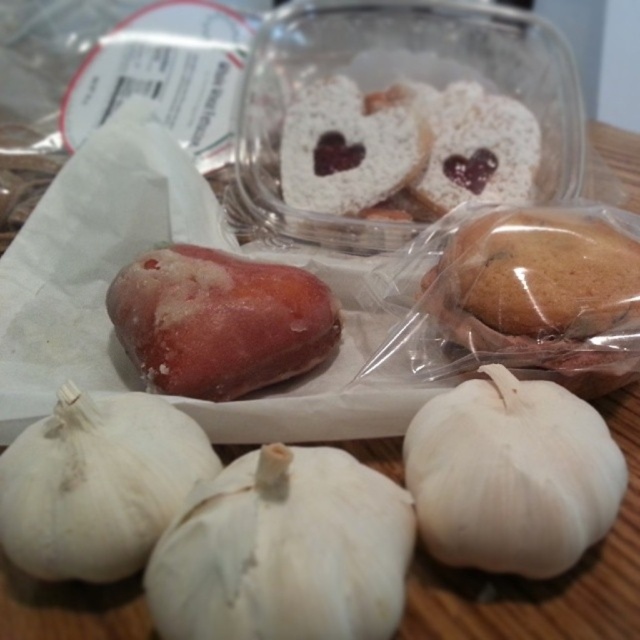
Is white matte garlic at center to the left of white matte garlic at lower center from the viewer's perspective?

Indeed, white matte garlic at center is positioned on the left side of white matte garlic at lower center.

Can you confirm if white matte garlic at center is thinner than white matte garlic at lower center?

No.

Does point (387, 525) lie behind point (541, 570)?

No, (387, 525) is closer to viewer.

In order to click on white matte garlic at center in this screenshot , I will do `click(284, 550)`.

Is white matte garlic at lower left to the right of frozen pinkish-red apple at center-left from the viewer's perspective?

Incorrect, white matte garlic at lower left is not on the right side of frozen pinkish-red apple at center-left.

Between white matte garlic at lower left and frozen pinkish-red apple at center-left, which one has less height?

white matte garlic at lower left

Which is behind, point (68, 506) or point (124, 323)?

Point (124, 323)

Where is `white matte garlic at lower left`? white matte garlic at lower left is located at coordinates (97, 483).

Is white matte garlic at lower center to the right of white matte garlic at lower left from the viewer's perspective?

Yes, white matte garlic at lower center is to the right of white matte garlic at lower left.

Between white matte garlic at lower center and white matte garlic at lower left, which one has more height?

Standing taller between the two is white matte garlic at lower center.

Is point (499, 438) in front of point (131, 540)?

No, it is not.

At what (x,y) coordinates should I click in order to perform the action: click on white matte garlic at lower center. Please return your answer as a coordinate pair (x, y). The image size is (640, 640). Looking at the image, I should click on (512, 474).